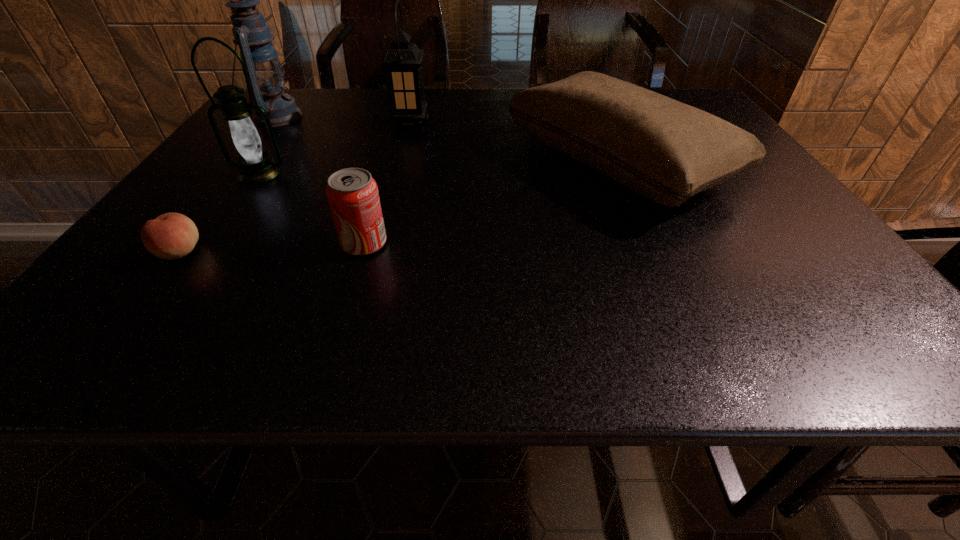
At what (x,y) coordinates should I click in order to perform the action: click on cushion that is at the far edge. Please return your answer as a coordinate pair (x, y). Looking at the image, I should click on coord(664,150).

The width and height of the screenshot is (960, 540). In order to click on peach that is at the left edge in this screenshot , I will do `click(170, 236)`.

The image size is (960, 540). In order to click on object at the right edge in this screenshot , I will do `click(664, 150)`.

Image resolution: width=960 pixels, height=540 pixels. In order to click on object that is at the far left corner in this screenshot , I will do `click(266, 78)`.

Identify the location of object that is at the far right corner. (664, 150).

In the image, there is a desktop. Identify the location of vacant space at the far edge. The height and width of the screenshot is (540, 960). (440, 115).

Locate an element on the screen. The image size is (960, 540). free region at the right edge of the desktop is located at coordinates (821, 275).

The height and width of the screenshot is (540, 960). I want to click on unoccupied position between the soda can and the cushion, so click(x=491, y=203).

At what (x,y) coordinates should I click in order to perform the action: click on vacant space in between the soda can and the rightmost object. Please return your answer as a coordinate pair (x, y). Looking at the image, I should click on (491, 203).

Where is `free space between the rightmost object and the soda can`? The image size is (960, 540). free space between the rightmost object and the soda can is located at coordinates (491, 203).